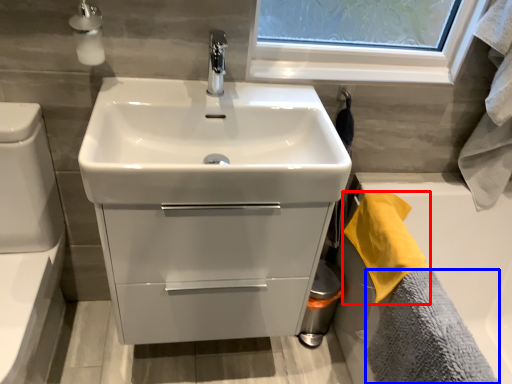
Question: Among these objects, which one is nearest to the camera, bath towel (highlighted by a red box) or bath towel (highlighted by a blue box)?

Choices:
 (A) bath towel
 (B) bath towel

Answer: (B)